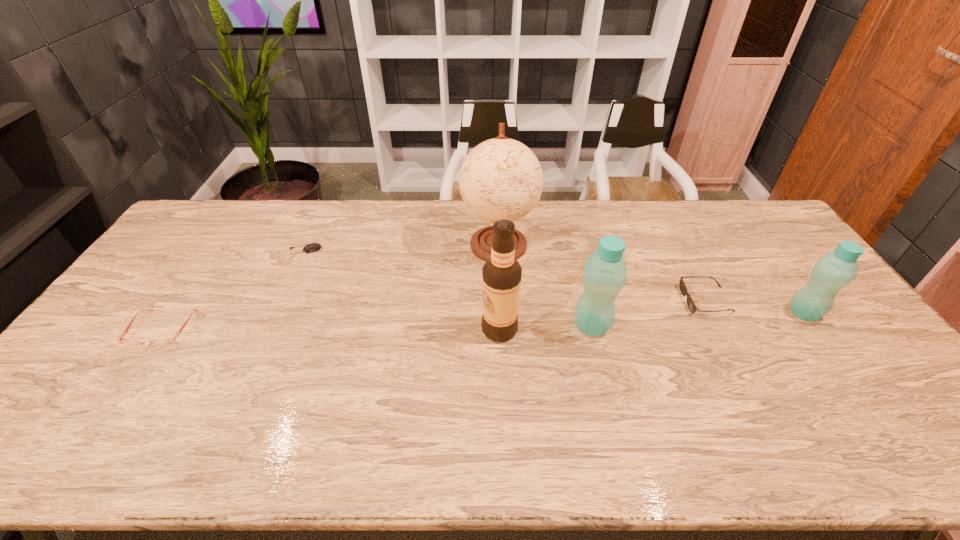
This screenshot has width=960, height=540. I want to click on free space located 0.130m on the lenses of the leftmost object, so click(119, 393).

Identify the location of object present at the far edge. (501, 178).

I want to click on object present at the left edge, so click(x=155, y=343).

The image size is (960, 540). I want to click on object that is at the right edge, so click(832, 272).

In the image, there is a desktop. At what (x,y) coordinates should I click in order to perform the action: click on vacant space at the far edge. Please return your answer as a coordinate pair (x, y). Looking at the image, I should click on (652, 203).

Identify the location of vacant point at the near edge. The width and height of the screenshot is (960, 540). (791, 397).

Identify the location of blank space at the left edge. The image size is (960, 540). (139, 294).

At what (x,y) coordinates should I click in order to perform the action: click on free space at the right edge. Please return your answer as a coordinate pair (x, y). The image size is (960, 540). Looking at the image, I should click on (778, 280).

Where is `free space at the far left corner of the desktop`? Image resolution: width=960 pixels, height=540 pixels. free space at the far left corner of the desktop is located at coordinates (195, 212).

Locate an element on the screen. The image size is (960, 540). free space at the far right corner is located at coordinates (769, 238).